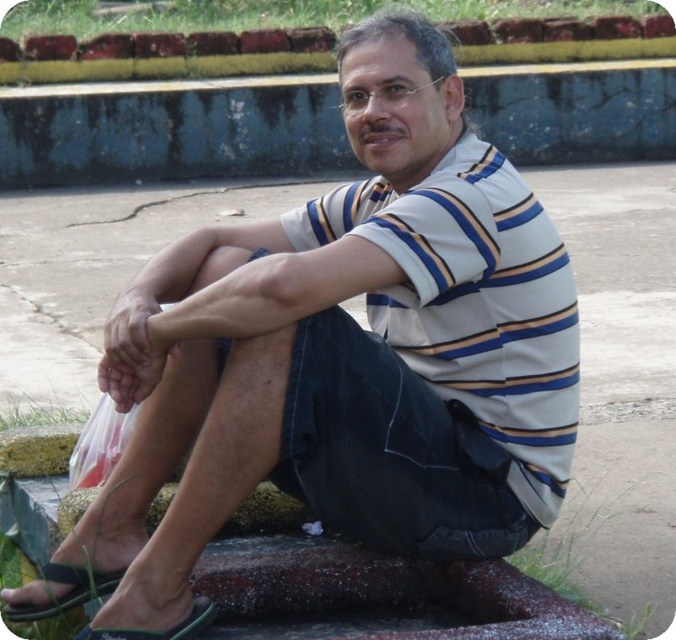
You are standing in the scene and need to pick up the green rubber sandal at lower left. Where exactly should you look to find it?

The green rubber sandal at lower left is located at point (66, 592).